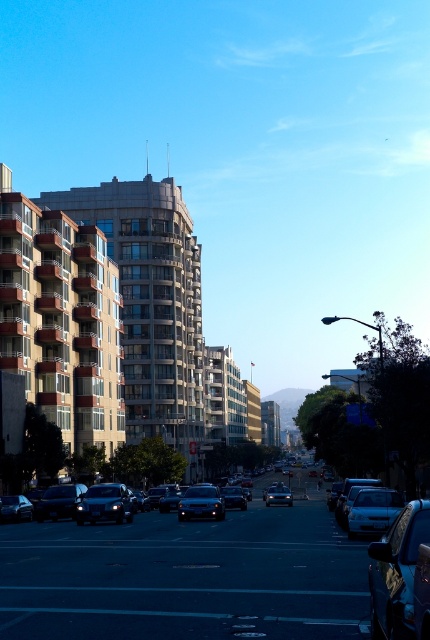
Based on the photo, you are a delivery person who needs to park your vehicle in a tight space between two shiny black sedans. You have to choose between the shiny black sedan at lower left and the shiny black sedan at center. Which one should you park next to to ensure your vehicle fits?

The shiny black sedan at lower left is wider than the shiny black sedan at center. Therefore, parking next to the shiny black sedan at center would provide more space for your vehicle to fit comfortably.

You are a pedestrian standing at the edge of the street. You see a shiny black car at lower right and a sleek silver sedan at center. Which car is nearer to you?

The shiny black car at lower right is closer to the viewer than the sleek silver sedan at center, so the shiny black car at lower right is nearer to you.

You are a delivery person who needs to park your shiny black car at lower right in a designated parking spot located at coordinate point 0.895, 0.923. Can you confirm if your car is already parked correctly?

The shiny black car at lower right is already positioned at point (396, 572), so it is correctly parked in the designated parking spot.